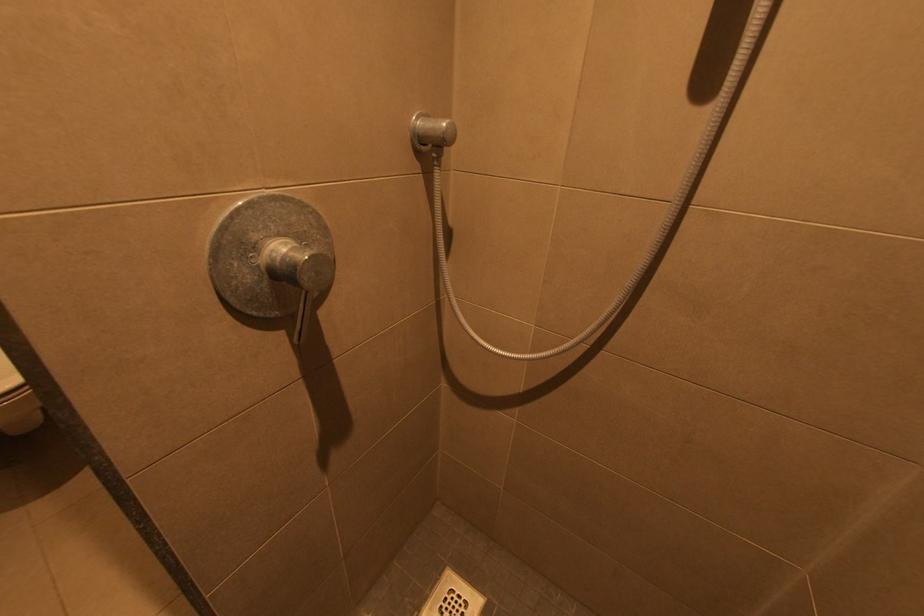
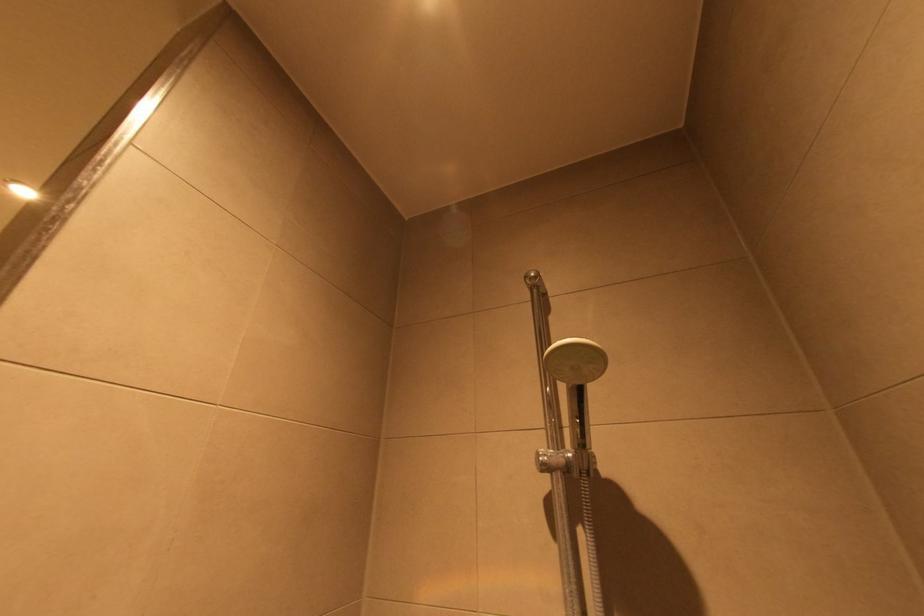
In the scene shown: The images are taken continuously from a first-person perspective. In which direction is your viewpoint rotating?

The camera rotated toward right-up.